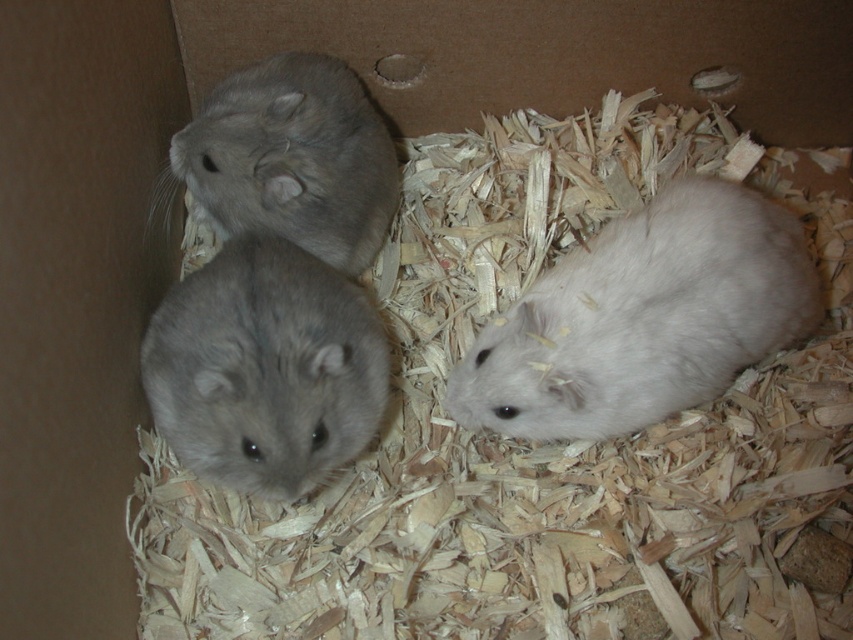
Question: Which object is farther from the camera taking this photo?

Choices:
 (A) white fluffy hamster at right
 (B) gray soft fur hamster at upper left

Answer: (B)

Question: Does gray soft fur hamster at center have a smaller size compared to gray soft fur hamster at upper left?

Choices:
 (A) no
 (B) yes

Answer: (B)

Question: Which of the following is the closest to the observer?

Choices:
 (A) (292, 232)
 (B) (699, 326)

Answer: (B)

Question: Does gray soft fur hamster at center have a greater width compared to gray soft fur hamster at upper left?

Choices:
 (A) no
 (B) yes

Answer: (A)

Question: Is gray soft fur hamster at center closer to the viewer compared to gray soft fur hamster at upper left?

Choices:
 (A) no
 (B) yes

Answer: (B)

Question: Which of these objects is positioned farthest from the gray soft fur hamster at upper left?

Choices:
 (A) white fluffy hamster at right
 (B) gray soft fur hamster at center

Answer: (A)